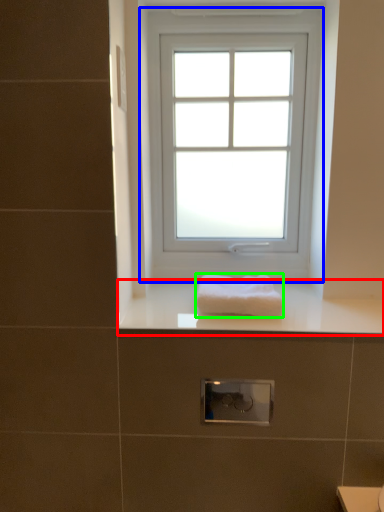
Question: Based on their relative distances, which object is nearer to counter top (highlighted by a red box)? Choose from window (highlighted by a blue box) and towel (highlighted by a green box).

Choices:
 (A) window
 (B) towel

Answer: (B)